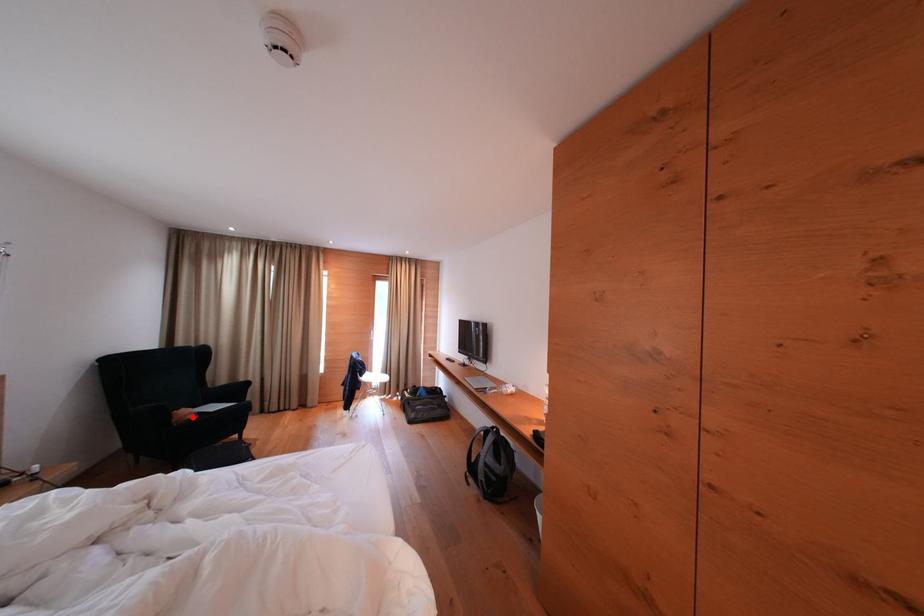
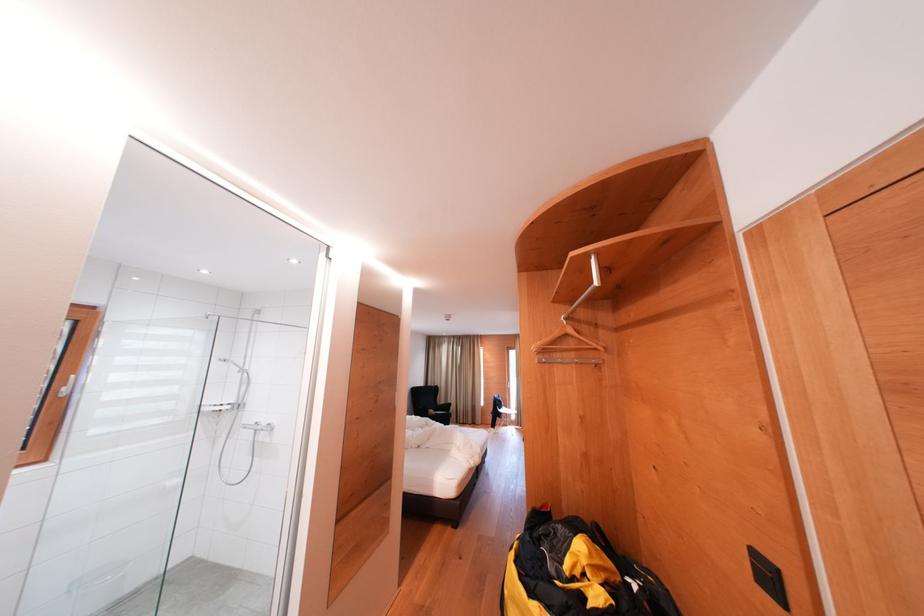
Question: I am providing you with two images of the same scene from different viewpoints. Given a red point in image1, look at the same physical point in image2. Is it:

Choices:
 (A) Closer to the viewpoint
 (B) Farther from the viewpoint

Answer: (B)